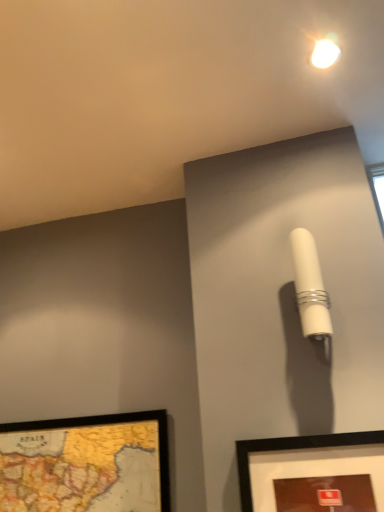
What do you see at coordinates (311, 291) in the screenshot? I see `white matte cylindrical lamp at upper right` at bounding box center [311, 291].

Find the location of a particular element. The image size is (384, 512). wooden map frame at lower left, marked as the second picture frame in a front-to-back arrangement is located at coordinates (86, 464).

What's the angular difference between matte black picture frame at lower right, which ranks as the second picture frame in back-to-front order, and white matte cylindrical lamp at upper right's facing directions?

They differ by 4.11 degrees in their facing directions.

From the image's perspective, between matte black picture frame at lower right, placed as the 2th picture frame when sorted from left to right, and white matte cylindrical lamp at upper right, who is located below?

From the image's view, matte black picture frame at lower right, placed as the 2th picture frame when sorted from left to right, is below.

Is matte black picture frame at lower right, the first picture frame when ordered from right to left, positioned with its back to white matte cylindrical lamp at upper right?

That's not correct — matte black picture frame at lower right, the first picture frame when ordered from right to left, is not looking away from white matte cylindrical lamp at upper right.

Looking at this image, which object is further away from the camera taking this photo, white glossy droplight at upper center or wooden map frame at lower left, positioned as the 1th picture frame in left-to-right order?

wooden map frame at lower left, positioned as the 1th picture frame in left-to-right order.

How different are the orientations of white glossy droplight at upper center and wooden map frame at lower left, the 1th picture frame viewed from the back, in degrees?

There is a 1.05-degree angle between the facing directions of white glossy droplight at upper center and wooden map frame at lower left, the 1th picture frame viewed from the back.

In the scene shown: Considering the relative sizes of white glossy droplight at upper center and wooden map frame at lower left, which is the 2th picture frame from right to left, in the image provided, is white glossy droplight at upper center taller than wooden map frame at lower left, which is the 2th picture frame from right to left,?

Incorrect, the height of white glossy droplight at upper center is not larger of that of wooden map frame at lower left, which is the 2th picture frame from right to left.

Is white glossy droplight at upper center in contact with wooden map frame at lower left, which is the 2th picture frame from right to left?

white glossy droplight at upper center is not next to wooden map frame at lower left, which is the 2th picture frame from right to left, and they're not touching.

What's the angular difference between matte black picture frame at lower right, which ranks as the second picture frame in back-to-front order, and wooden map frame at lower left, positioned as the 1th picture frame in left-to-right order,'s facing directions?

0.0362 degrees.

Considering the sizes of matte black picture frame at lower right, which ranks as the 1th picture frame in front-to-back order, and wooden map frame at lower left, which is the 2th picture frame from right to left, in the image, is matte black picture frame at lower right, which ranks as the 1th picture frame in front-to-back order, wider or thinner than wooden map frame at lower left, which is the 2th picture frame from right to left,?

In the image, matte black picture frame at lower right, which ranks as the 1th picture frame in front-to-back order, appears to be wider than wooden map frame at lower left, which is the 2th picture frame from right to left.

Is wooden map frame at lower left, marked as the second picture frame in a front-to-back arrangement, at the back of matte black picture frame at lower right, which ranks as the 1th picture frame in front-to-back order?

matte black picture frame at lower right, which ranks as the 1th picture frame in front-to-back order, is not turned away from wooden map frame at lower left, marked as the second picture frame in a front-to-back arrangement.

Considering the sizes of matte black picture frame at lower right, placed as the 2th picture frame when sorted from left to right, and wooden map frame at lower left, the 1th picture frame viewed from the back, in the image, is matte black picture frame at lower right, placed as the 2th picture frame when sorted from left to right, taller or shorter than wooden map frame at lower left, the 1th picture frame viewed from the back,?

In the image, matte black picture frame at lower right, placed as the 2th picture frame when sorted from left to right, appears to be shorter than wooden map frame at lower left, the 1th picture frame viewed from the back.

Is white glossy droplight at upper center a part of matte black picture frame at lower right, the first picture frame when ordered from right to left?

No, white glossy droplight at upper center is located outside of matte black picture frame at lower right, the first picture frame when ordered from right to left.

Considering the sizes of objects matte black picture frame at lower right, placed as the 2th picture frame when sorted from left to right, and white glossy droplight at upper center in the image provided, who is thinner, matte black picture frame at lower right, placed as the 2th picture frame when sorted from left to right, or white glossy droplight at upper center?

Thinner between the two is matte black picture frame at lower right, placed as the 2th picture frame when sorted from left to right.

Which object is closer to the camera, matte black picture frame at lower right, the first picture frame when ordered from right to left, or white glossy droplight at upper center?

matte black picture frame at lower right, the first picture frame when ordered from right to left, is more forward.

How many degrees apart are the facing directions of white glossy droplight at upper center and matte black picture frame at lower right, placed as the 2th picture frame when sorted from left to right?

The angle between the facing direction of white glossy droplight at upper center and the facing direction of matte black picture frame at lower right, placed as the 2th picture frame when sorted from left to right, is 1.09 degrees.

From the image's perspective, is white glossy droplight at upper center located above or below matte black picture frame at lower right, placed as the 2th picture frame when sorted from left to right?

Based on their image positions, white glossy droplight at upper center is located above matte black picture frame at lower right, placed as the 2th picture frame when sorted from left to right.

Can you confirm if white glossy droplight at upper center is positioned to the right of matte black picture frame at lower right, which ranks as the 1th picture frame in front-to-back order?

Yes, white glossy droplight at upper center is to the right of matte black picture frame at lower right, which ranks as the 1th picture frame in front-to-back order.

Locate an element on the screen. The image size is (384, 512). droplight located behind the matte black picture frame at lower right, placed as the 2th picture frame when sorted from left to right is located at coordinates (325, 53).

Which object is positioned more to the right, wooden map frame at lower left, the 1th picture frame viewed from the back, or matte black picture frame at lower right, which ranks as the second picture frame in back-to-front order?

Positioned to the right is matte black picture frame at lower right, which ranks as the second picture frame in back-to-front order.

Is wooden map frame at lower left, which is the 2th picture frame from right to left, next to matte black picture frame at lower right, which ranks as the 1th picture frame in front-to-back order, and touching it?

No, wooden map frame at lower left, which is the 2th picture frame from right to left, is not with matte black picture frame at lower right, which ranks as the 1th picture frame in front-to-back order.

Considering the sizes of objects wooden map frame at lower left, which is the 2th picture frame from right to left, and matte black picture frame at lower right, placed as the 2th picture frame when sorted from left to right, in the image provided, who is taller, wooden map frame at lower left, which is the 2th picture frame from right to left, or matte black picture frame at lower right, placed as the 2th picture frame when sorted from left to right,?

wooden map frame at lower left, which is the 2th picture frame from right to left, is taller.

Considering the positions of points (157, 436) and (301, 505), is point (157, 436) closer to camera compared to point (301, 505)?

No, it is not.

Looking at this image, is wooden map frame at lower left, positioned as the 1th picture frame in left-to-right order, spatially inside white matte cylindrical lamp at upper right, or outside of it?

wooden map frame at lower left, positioned as the 1th picture frame in left-to-right order, is spatially situated outside white matte cylindrical lamp at upper right.

Considering the sizes of objects wooden map frame at lower left, the 1th picture frame viewed from the back, and white matte cylindrical lamp at upper right in the image provided, who is bigger, wooden map frame at lower left, the 1th picture frame viewed from the back, or white matte cylindrical lamp at upper right?

With larger size is wooden map frame at lower left, the 1th picture frame viewed from the back.

Image resolution: width=384 pixels, height=512 pixels. There is a white matte cylindrical lamp at upper right. Find the location of `the 1st picture frame below it (from the image's perspective)`. the 1st picture frame below it (from the image's perspective) is located at coordinates (313, 473).

Where is `droplight above the wooden map frame at lower left, the 1th picture frame viewed from the back (from the image's perspective)`? droplight above the wooden map frame at lower left, the 1th picture frame viewed from the back (from the image's perspective) is located at coordinates click(x=325, y=53).

When comparing their distances from matte black picture frame at lower right, the first picture frame when ordered from right to left, does wooden map frame at lower left, which is the 2th picture frame from right to left, or white matte cylindrical lamp at upper right seem further?

wooden map frame at lower left, which is the 2th picture frame from right to left.

Based on their spatial positions, is wooden map frame at lower left, positioned as the 1th picture frame in left-to-right order, or white glossy droplight at upper center closer to matte black picture frame at lower right, placed as the 2th picture frame when sorted from left to right?

wooden map frame at lower left, positioned as the 1th picture frame in left-to-right order, is closer to matte black picture frame at lower right, placed as the 2th picture frame when sorted from left to right.

From the image, which object appears to be nearer to wooden map frame at lower left, the 1th picture frame viewed from the back, white glossy droplight at upper center or white matte cylindrical lamp at upper right?

Based on the image, white matte cylindrical lamp at upper right appears to be nearer to wooden map frame at lower left, the 1th picture frame viewed from the back.

Estimate the real-world distances between objects in this image. Which object is closer to white matte cylindrical lamp at upper right, matte black picture frame at lower right, which ranks as the 1th picture frame in front-to-back order, or wooden map frame at lower left, the 1th picture frame viewed from the back?

matte black picture frame at lower right, which ranks as the 1th picture frame in front-to-back order, is positioned closer to the anchor white matte cylindrical lamp at upper right.

Based on their spatial positions, is white matte cylindrical lamp at upper right or wooden map frame at lower left, which is the 2th picture frame from right to left, further from white glossy droplight at upper center?

wooden map frame at lower left, which is the 2th picture frame from right to left.

Considering their positions, is white matte cylindrical lamp at upper right positioned closer to wooden map frame at lower left, marked as the second picture frame in a front-to-back arrangement, than matte black picture frame at lower right, which ranks as the second picture frame in back-to-front order?

matte black picture frame at lower right, which ranks as the second picture frame in back-to-front order, is closer to wooden map frame at lower left, marked as the second picture frame in a front-to-back arrangement.

From the picture: Which object lies nearer to the anchor point white matte cylindrical lamp at upper right, white glossy droplight at upper center or wooden map frame at lower left, the 1th picture frame viewed from the back?

white glossy droplight at upper center is positioned closer to the anchor white matte cylindrical lamp at upper right.

Considering their positions, is white matte cylindrical lamp at upper right positioned further to wooden map frame at lower left, which is the 2th picture frame from right to left, than white glossy droplight at upper center?

white glossy droplight at upper center is positioned further to the anchor wooden map frame at lower left, which is the 2th picture frame from right to left.

This screenshot has width=384, height=512. In order to click on table lamp between white glossy droplight at upper center and wooden map frame at lower left, which is the 2th picture frame from right to left, in the up-down direction in this screenshot , I will do `click(311, 291)`.

This screenshot has height=512, width=384. Identify the location of table lamp that lies between white glossy droplight at upper center and matte black picture frame at lower right, which ranks as the second picture frame in back-to-front order, from top to bottom. (311, 291).

Image resolution: width=384 pixels, height=512 pixels. Identify the location of picture frame between wooden map frame at lower left, marked as the second picture frame in a front-to-back arrangement, and white matte cylindrical lamp at upper right, in the horizontal direction. (313, 473).

Locate an element on the screen. The width and height of the screenshot is (384, 512). picture frame that lies between white glossy droplight at upper center and wooden map frame at lower left, the 1th picture frame viewed from the back, from top to bottom is located at coordinates (313, 473).